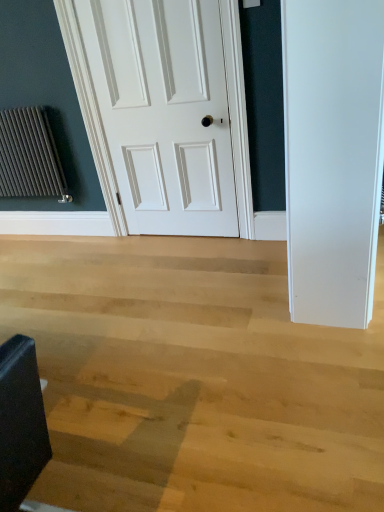
Question: Is dark gray textured radiator at left bigger or smaller than white matte door at center?

Choices:
 (A) small
 (B) big

Answer: (A)

Question: Would you say dark gray textured radiator at left is inside or outside white matte door at center?

Choices:
 (A) outside
 (B) inside

Answer: (A)

Question: Is point (19, 129) closer or farther from the camera than point (216, 210)?

Choices:
 (A) farther
 (B) closer

Answer: (A)

Question: Is point (175, 5) positioned closer to the camera than point (21, 112)?

Choices:
 (A) farther
 (B) closer

Answer: (B)

Question: From their relative heights in the image, would you say white matte door at center is taller or shorter than dark gray textured radiator at left?

Choices:
 (A) short
 (B) tall

Answer: (B)

Question: Do you think white matte door at center is within dark gray textured radiator at left, or outside of it?

Choices:
 (A) inside
 (B) outside

Answer: (B)

Question: From the image's perspective, is white matte door at center positioned above or below dark gray textured radiator at left?

Choices:
 (A) above
 (B) below

Answer: (A)